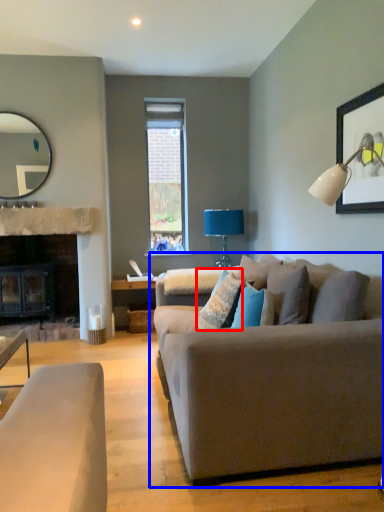
Question: Which point is closer to the camera, pillow (highlighted by a red box) or studio couch (highlighted by a blue box)?

Choices:
 (A) pillow
 (B) studio couch

Answer: (B)